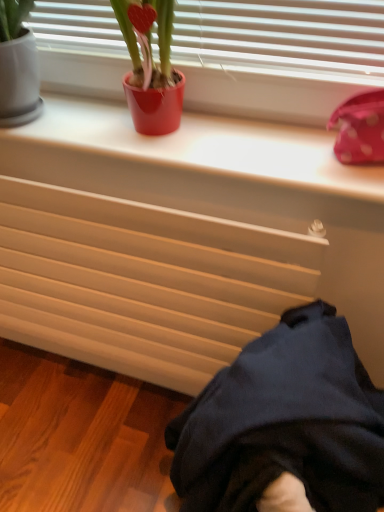
At what (x,y) coordinates should I click in order to perform the action: click on shiny red pot at upper center. Please return your answer as a coordinate pair (x, y). The image size is (384, 512). Looking at the image, I should click on coord(150,66).

Looking at the image, does shiny red pot at upper center seem bigger or smaller compared to matte beige radiator at lower center?

shiny red pot at upper center is smaller than matte beige radiator at lower center.

Where is `radiator that appears on the left of shiny red pot at upper center`? This screenshot has height=512, width=384. radiator that appears on the left of shiny red pot at upper center is located at coordinates (142, 282).

Is shiny red pot at upper center oriented towards matte beige radiator at lower center?

No, shiny red pot at upper center is not turned towards matte beige radiator at lower center.

Between point (159, 23) and point (106, 219), which one is positioned behind?

Point (106, 219)

Looking at their sizes, would you say dark blue fabric at lower right is wider or thinner than matte beige radiator at lower center?

Clearly, dark blue fabric at lower right has more width compared to matte beige radiator at lower center.

From a real-world perspective, is dark blue fabric at lower right below matte beige radiator at lower center?

Yes, from a real-world perspective, dark blue fabric at lower right is below matte beige radiator at lower center.

Does dark blue fabric at lower right turn towards matte beige radiator at lower center?

No, dark blue fabric at lower right is not oriented towards matte beige radiator at lower center.

Can you tell me how much dark blue fabric at lower right and matte beige radiator at lower center differ in facing direction?

dark blue fabric at lower right and matte beige radiator at lower center are facing 92.4 degrees away from each other.

Between white smooth window sill at upper center and shiny red pot at upper center, which one has smaller size?

With smaller size is shiny red pot at upper center.

Is white smooth window sill at upper center oriented away from shiny red pot at upper center?

That's not correct — white smooth window sill at upper center is not looking away from shiny red pot at upper center.

Is shiny red pot at upper center inside white smooth window sill at upper center?

No, shiny red pot at upper center is located outside of white smooth window sill at upper center.

From the picture: Which object is further away from the camera, matte beige radiator at lower center or dark blue fabric at lower right?

matte beige radiator at lower center is further away from the camera.

From the image's perspective, is matte beige radiator at lower center beneath dark blue fabric at lower right?

No.

Find the location of a particular element. The image size is (384, 512). radiator above the dark blue fabric at lower right (from the image's perspective) is located at coordinates (142, 282).

Can you tell me how much matte beige radiator at lower center and dark blue fabric at lower right differ in facing direction?

They differ by 92.4 degrees in their facing directions.

Which is more to the right, white smooth window sill at upper center or dark blue fabric at lower right?

From the viewer's perspective, dark blue fabric at lower right appears more on the right side.

Image resolution: width=384 pixels, height=512 pixels. I want to click on window sill lying behind the dark blue fabric at lower right, so click(208, 146).

In terms of height, does white smooth window sill at upper center look taller or shorter compared to dark blue fabric at lower right?

In the image, white smooth window sill at upper center appears to be shorter than dark blue fabric at lower right.

Between white smooth window sill at upper center and dark blue fabric at lower right, which one has larger width?

dark blue fabric at lower right.

Locate an element on the screen. The height and width of the screenshot is (512, 384). radiator lying on the left of white smooth window sill at upper center is located at coordinates (142, 282).

Does white smooth window sill at upper center have a smaller size compared to matte beige radiator at lower center?

Indeed, white smooth window sill at upper center has a smaller size compared to matte beige radiator at lower center.

Would you consider white smooth window sill at upper center to be distant from matte beige radiator at lower center?

They are positioned close to each other.

Is the surface of shiny red pot at upper center in direct contact with dark blue fabric at lower right?

No.

Considering the sizes of shiny red pot at upper center and dark blue fabric at lower right in the image, is shiny red pot at upper center bigger or smaller than dark blue fabric at lower right?

shiny red pot at upper center is smaller than dark blue fabric at lower right.

From the image's perspective, between shiny red pot at upper center and dark blue fabric at lower right, which one is located above?

shiny red pot at upper center appears higher in the image.

Image resolution: width=384 pixels, height=512 pixels. What are the coordinates of `houseplant above the matte beige radiator at lower center (from the image's perspective)` in the screenshot? It's located at (150, 66).

The height and width of the screenshot is (512, 384). Find the location of `clothing below the matte beige radiator at lower center (from the image's perspective)`. clothing below the matte beige radiator at lower center (from the image's perspective) is located at coordinates (284, 422).

Which object lies further to the anchor point matte beige radiator at lower center, shiny red pot at upper center or dark blue fabric at lower right?

shiny red pot at upper center lies further to matte beige radiator at lower center than the other object.

Estimate the real-world distances between objects in this image. Which object is further from white smooth window sill at upper center, matte beige radiator at lower center or shiny red pot at upper center?

matte beige radiator at lower center.

Based on their spatial positions, is shiny red pot at upper center or white smooth window sill at upper center further from dark blue fabric at lower right?

Among the two, shiny red pot at upper center is located further to dark blue fabric at lower right.

Which object lies further to the anchor point dark blue fabric at lower right, matte beige radiator at lower center or shiny red pot at upper center?

shiny red pot at upper center lies further to dark blue fabric at lower right than the other object.

Which object lies further to the anchor point matte beige radiator at lower center, dark blue fabric at lower right or shiny red pot at upper center?

shiny red pot at upper center is further to matte beige radiator at lower center.

Considering their positions, is matte beige radiator at lower center positioned further to shiny red pot at upper center than dark blue fabric at lower right?

The object further to shiny red pot at upper center is dark blue fabric at lower right.

Based on their spatial positions, is dark blue fabric at lower right or matte beige radiator at lower center further from shiny red pot at upper center?

Based on the image, dark blue fabric at lower right appears to be further to shiny red pot at upper center.

When comparing their distances from matte beige radiator at lower center, does white smooth window sill at upper center or dark blue fabric at lower right seem further?

dark blue fabric at lower right lies further to matte beige radiator at lower center than the other object.

At what (x,y) coordinates should I click in order to perform the action: click on radiator between white smooth window sill at upper center and dark blue fabric at lower right from top to bottom. Please return your answer as a coordinate pair (x, y). Image resolution: width=384 pixels, height=512 pixels. Looking at the image, I should click on (142, 282).

The image size is (384, 512). I want to click on radiator between shiny red pot at upper center and dark blue fabric at lower right in the vertical direction, so click(142, 282).

You are a GUI agent. You are given a task and a screenshot of the screen. Output one action in this format:
    pyautogui.click(x=<x>, y=<y>)
    Task: Click on the window sill that lies between shiny red pot at upper center and matte beige radiator at lower center from top to bottom
    
    Given the screenshot: What is the action you would take?
    pyautogui.click(x=208, y=146)

I want to click on window sill between shiny red pot at upper center and dark blue fabric at lower right from top to bottom, so click(208, 146).